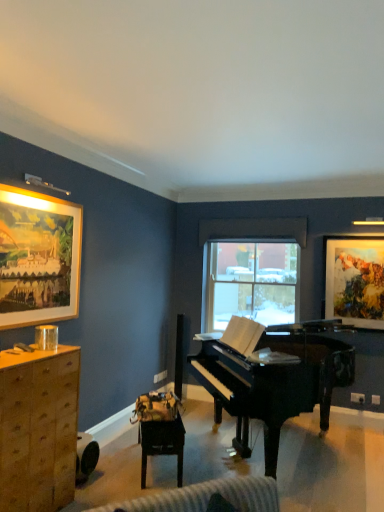
Question: From a real-world perspective, is wooden cabinet at left located higher than watercolor paper painting at upper right, which appears as the first picture frame when viewed from the back?

Choices:
 (A) no
 (B) yes

Answer: (A)

Question: Is wooden cabinet at left at the right side of watercolor paper painting at upper right, arranged as the second picture frame when viewed from the front?

Choices:
 (A) no
 (B) yes

Answer: (A)

Question: Can you confirm if wooden cabinet at left is wider than watercolor paper painting at upper right, which appears as the first picture frame when viewed from the back?

Choices:
 (A) yes
 (B) no

Answer: (A)

Question: Considering the relative sizes of wooden cabinet at left and watercolor paper painting at upper right, positioned as the 1th picture frame in right-to-left order, in the image provided, is wooden cabinet at left bigger than watercolor paper painting at upper right, positioned as the 1th picture frame in right-to-left order,?

Choices:
 (A) no
 (B) yes

Answer: (B)

Question: Does wooden cabinet at left have a lesser width compared to watercolor paper painting at upper right, positioned as the 1th picture frame in right-to-left order?

Choices:
 (A) yes
 (B) no

Answer: (B)

Question: Considering the positions of wooden cabinet at left and watercolor paper painting at upper right, which appears as the first picture frame when viewed from the back, in the image, is wooden cabinet at left wider or thinner than watercolor paper painting at upper right, which appears as the first picture frame when viewed from the back,?

Choices:
 (A) thin
 (B) wide

Answer: (B)

Question: Is wooden cabinet at left taller or shorter than watercolor paper painting at upper right, acting as the second picture frame starting from the left?

Choices:
 (A) short
 (B) tall

Answer: (B)

Question: In terms of size, does wooden cabinet at left appear bigger or smaller than watercolor paper painting at upper right, acting as the second picture frame starting from the left?

Choices:
 (A) big
 (B) small

Answer: (A)

Question: Is wooden cabinet at left in front of or behind watercolor paper painting at upper right, which appears as the first picture frame when viewed from the back, in the image?

Choices:
 (A) behind
 (B) front

Answer: (B)

Question: Is glossy black piano at center inside the boundaries of wooden framed painting at upper left, acting as the second picture frame starting from the back, or outside?

Choices:
 (A) inside
 (B) outside

Answer: (B)

Question: Looking at their shapes, would you say glossy black piano at center is wider or thinner than wooden framed painting at upper left, acting as the second picture frame starting from the back?

Choices:
 (A) thin
 (B) wide

Answer: (B)

Question: Based on their sizes in the image, would you say glossy black piano at center is bigger or smaller than wooden framed painting at upper left, which is the second picture frame from right to left?

Choices:
 (A) big
 (B) small

Answer: (A)

Question: From a real-world perspective, is glossy black piano at center physically located above or below wooden framed painting at upper left, which appears as the first picture frame when viewed from the left?

Choices:
 (A) below
 (B) above

Answer: (A)

Question: Based on their positions, is wooden cabinet at left located to the left or right of wooden framed painting at upper left, the first picture frame positioned from the front?

Choices:
 (A) left
 (B) right

Answer: (B)

Question: Considering the positions of wooden cabinet at left and wooden framed painting at upper left, which is the second picture frame from right to left, in the image, is wooden cabinet at left wider or thinner than wooden framed painting at upper left, which is the second picture frame from right to left,?

Choices:
 (A) wide
 (B) thin

Answer: (A)